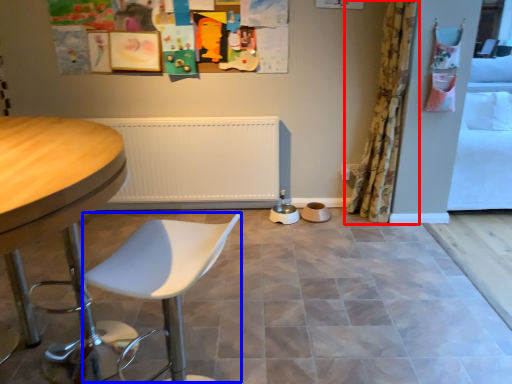
Question: Which object is closer to the camera taking this photo, curtain (highlighted by a red box) or swivel chair (highlighted by a blue box)?

Choices:
 (A) curtain
 (B) swivel chair

Answer: (B)